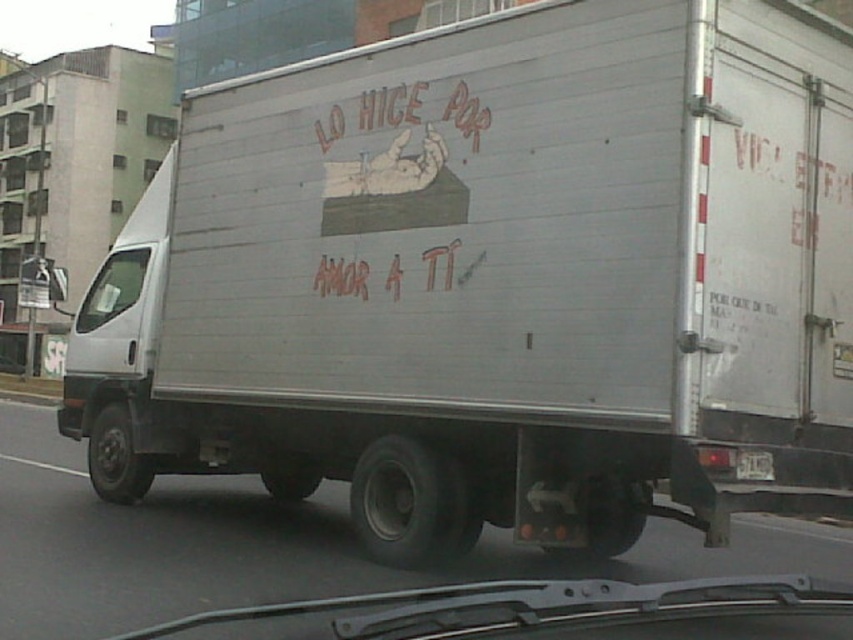
You are a pedestrian standing in front of the white delivery truck parked on the street. You notice a point at coordinates [112,289]. What object is located at that point?

The point at coordinates [112,289] indicates the transparent glass windshield at the left of the truck.

You are a delivery driver who needs to check the license plate number of your truck. However, you can only look through the transparent glass windshield at left. Can you see the white plastic license plate at center clearly from your current position?

The transparent glass windshield at left is much taller than the white plastic license plate at center, so yes, you can see the white plastic license plate at center clearly through the transparent glass windshield at left.

You are standing on the sidewalk in front of the white delivery truck. You want to take a photo of the hand holding a heart illustration on the truck. The camera you have can focus on objects up to 10 meters away. Is the point where the hand holding a heart illustration is located at point (125, 307) within the camera focus range?

The distance of point (125, 307) from the viewer is 9.31 meters, which is within the camera focus range of up to 10 meters. Therefore, the camera can focus on the hand holding a heart illustration at that point.